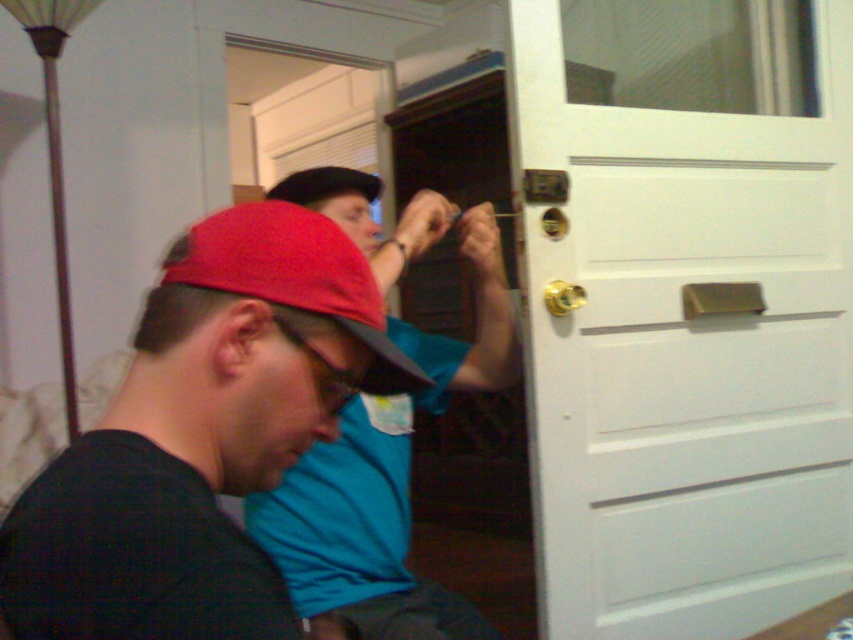
You are standing in front of the white door and need to locate two specific points marked on the door. The first point is at coordinate point(836,419) and the second is at point(563,285). Which point is closer to the lock mechanism located near the top right corner of the door?

Point(836,419) is closer to the lock mechanism located near the top right corner of the door because it is positioned behind point(563,285), which is farther away from the top right corner.

You are a delivery person with a 1.5 meter long package. You need to bring it through the entrance where the white painted wood door at center right is located. Can you fit the package through the doorway without tilting it?

The distance between the white painted wood door at center right and the viewer is 1.51 meters. Since the package is 1.5 meters long, it can fit through the doorway as the distance is slightly longer than the package.